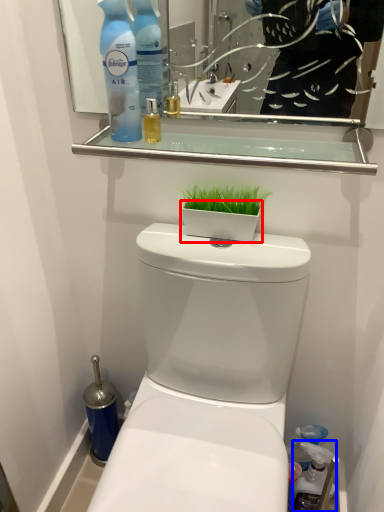
Question: Which object appears farthest to the camera in this image, flowerpot (highlighted by a red box) or cleaning product (highlighted by a blue box)?

Choices:
 (A) flowerpot
 (B) cleaning product

Answer: (B)